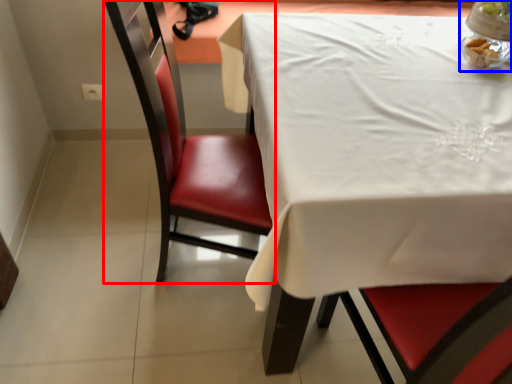
Question: Which object is further to the camera taking this photo, chair (highlighted by a red box) or tableware (highlighted by a blue box)?

Choices:
 (A) chair
 (B) tableware

Answer: (B)